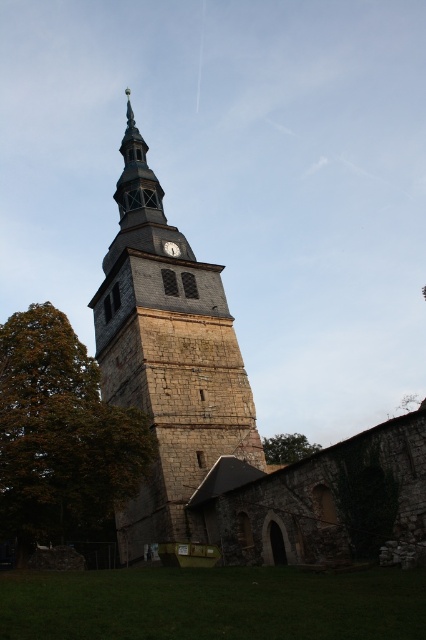
You are standing in front of the historic stone tower and want to take a photo that includes both the stone clock tower at center and the green leafy tree at left. Which object should you position closer to the edge of the frame to ensure both are fully visible?

The green leafy tree at left should be positioned closer to the edge of the frame because the stone clock tower at center is taller than the green leafy tree at left, so the tower will occupy more vertical space and needs to be centered to fit properly.

You are standing in front of the historic stone tower. There is a point marked at coordinates (60, 435). What object is located at this point?

The point at coordinates (60, 435) corresponds to the green leafy tree at left.